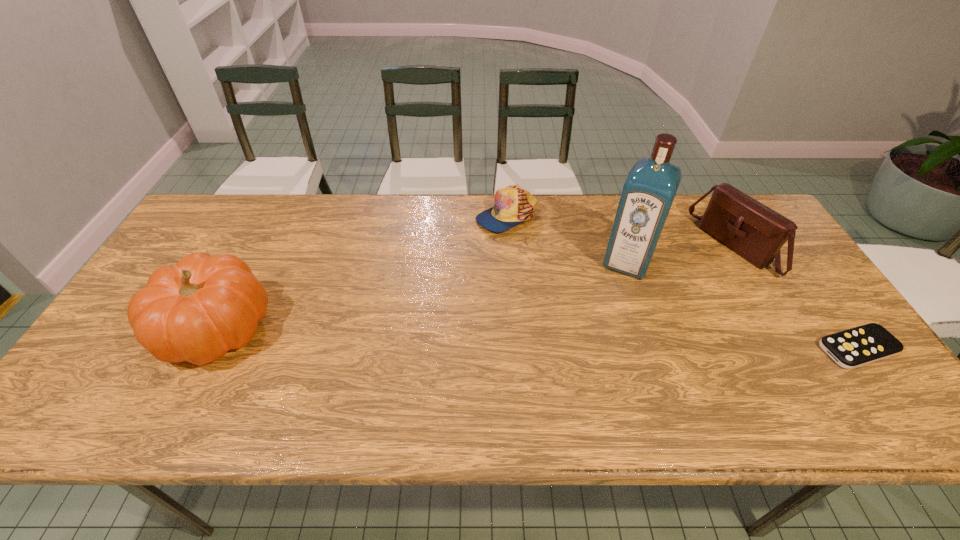
Where is `cap present at the far edge`? cap present at the far edge is located at coordinates (512, 205).

This screenshot has height=540, width=960. I want to click on pumpkin that is positioned at the near edge, so click(x=197, y=310).

The height and width of the screenshot is (540, 960). In order to click on remote control that is at the near edge in this screenshot , I will do `click(851, 348)`.

Where is `object at the left edge`? The width and height of the screenshot is (960, 540). object at the left edge is located at coordinates [x=197, y=310].

This screenshot has width=960, height=540. I want to click on remote control located in the right edge section of the desktop, so click(851, 348).

The width and height of the screenshot is (960, 540). What are the coordinates of `shoulder bag positioned at the right edge` in the screenshot? It's located at (751, 229).

Identify the location of object that is at the near left corner. The width and height of the screenshot is (960, 540). (197, 310).

Locate an element on the screen. object located at the far right corner is located at coordinates (751, 229).

The height and width of the screenshot is (540, 960). Find the location of `object situated at the near right corner`. object situated at the near right corner is located at coordinates (851, 348).

Identify the location of vacant region at the far edge. (488, 206).